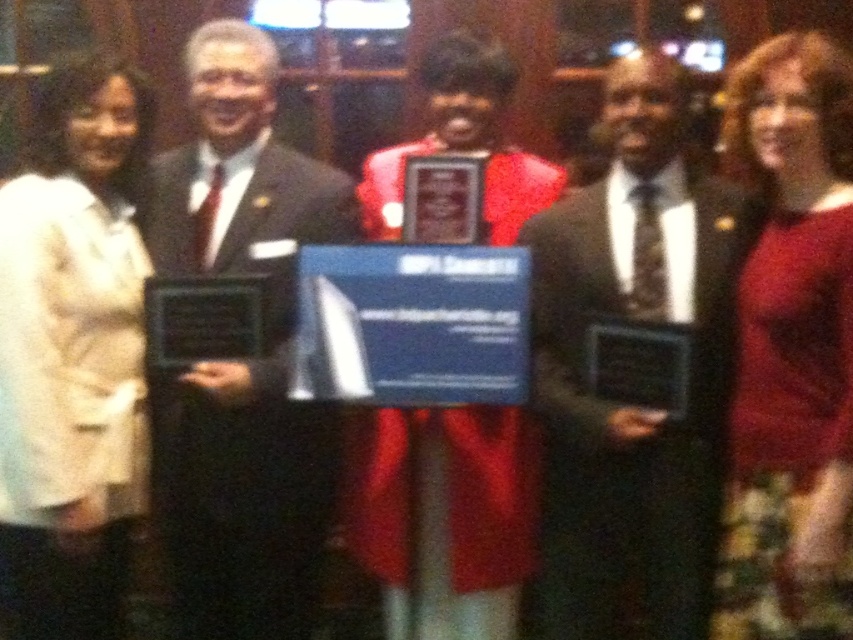
You are a photographer at the event and want to capture a clear photo of the shiny black suit at center without the matte black suit at center blocking it. How should you adjust your position?

Move closer to the shiny black suit at center so that it is no longer behind the matte black suit at center.

Based on the scene description, what object is located at the coordinates point (631, 400)?

The shiny black suit at center is located at point (631, 400).